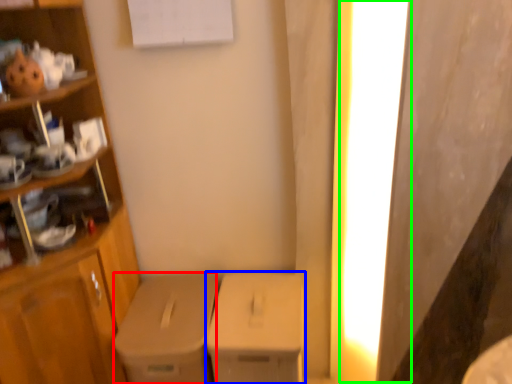
Question: Estimate the real-world distances between objects in this image. Which object is farther from cardboard box (highlighted by a red box), cardboard box (highlighted by a blue box) or lighting (highlighted by a green box)?

Choices:
 (A) cardboard box
 (B) lighting

Answer: (B)